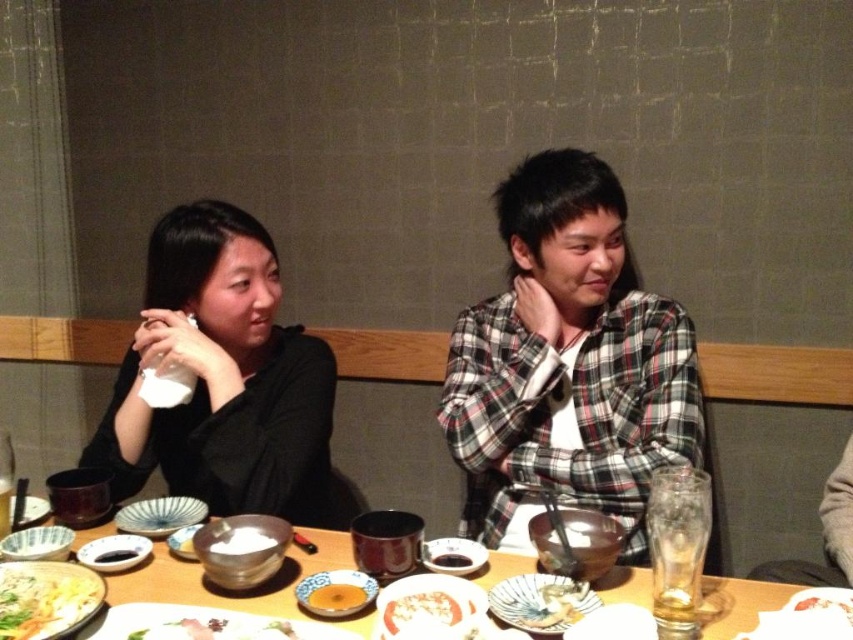
Question: Does matte white plate at center appear under matte black plate at center?

Choices:
 (A) yes
 (B) no

Answer: (A)

Question: Is black matte shirt at left thinner than yellow matte bowl at center?

Choices:
 (A) no
 (B) yes

Answer: (A)

Question: Which of the following is the farthest from the observer?

Choices:
 (A) (740, 618)
 (B) (445, 588)
 (C) (44, 616)
 (D) (547, 573)

Answer: (D)

Question: Based on their relative distances, which object is nearer to the black matte shirt at left?

Choices:
 (A) matte ceramic plate at center
 (B) matte black plate at center

Answer: (B)

Question: Among these points, which one is nearest to the camera?

Choices:
 (A) (555, 586)
 (B) (32, 502)
 (C) (107, 541)

Answer: (A)

Question: Can you confirm if smooth white rice at center is positioned above yellow matte bowl at center?

Choices:
 (A) yes
 (B) no

Answer: (B)